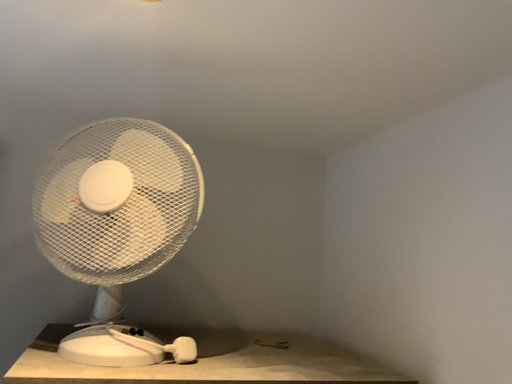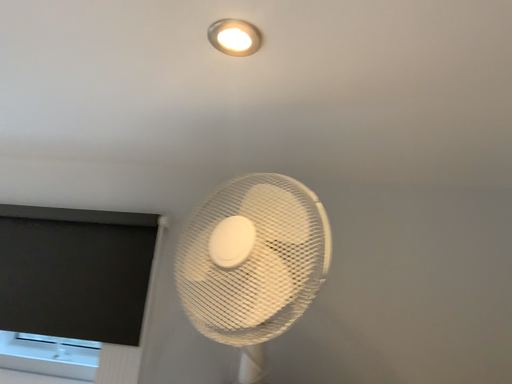
Question: Which way did the camera rotate in the video?

Choices:
 (A) rotated downward
 (B) rotated upward

Answer: (B)